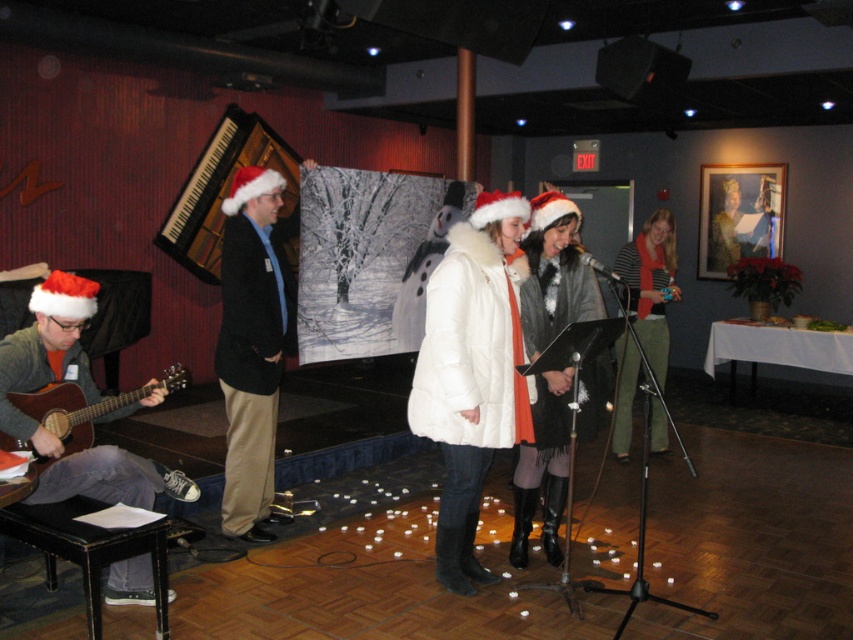
Question: Observing the image, what is the correct spatial positioning of black woolen jacket at center in reference to orange scarf at center?

Choices:
 (A) left
 (B) right

Answer: (A)

Question: Which object appears closest to the camera in this image?

Choices:
 (A) black matte microphone at center
 (B) black woolen jacket at center
 (C) white fur coat at center

Answer: (A)

Question: Is matte brown acoustic guitar at lower left thinner than black matte microphone at center?

Choices:
 (A) yes
 (B) no

Answer: (B)

Question: Which object is closer to the camera taking this photo?

Choices:
 (A) black matte microphone at center
 (B) white fur coat at center
 (C) matte gray sweater at lower left

Answer: (C)

Question: Which of these objects is positioned farthest from the white fur coat at center?

Choices:
 (A) black matte microphone at center
 (B) matte gray sweater at lower left
 (C) black woolen jacket at center

Answer: (B)

Question: Is matte gray sweater at lower left thinner than orange scarf at center?

Choices:
 (A) yes
 (B) no

Answer: (A)